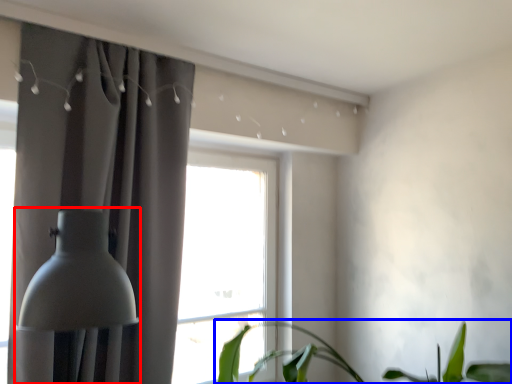
Question: Which of the following is the farthest to the observer, table lamp (highlighted by a red box) or houseplant (highlighted by a blue box)?

Choices:
 (A) table lamp
 (B) houseplant

Answer: (A)